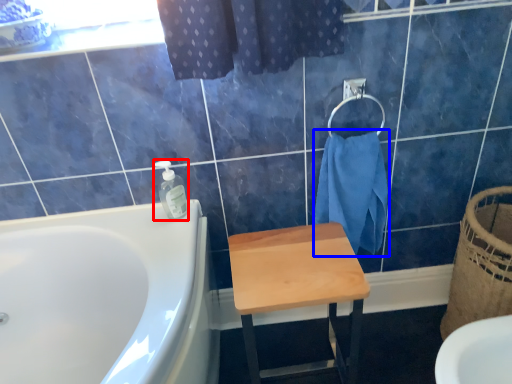
Question: Which object is closer to the camera taking this photo, soap dispenser (highlighted by a red box) or bath towel (highlighted by a blue box)?

Choices:
 (A) soap dispenser
 (B) bath towel

Answer: (B)